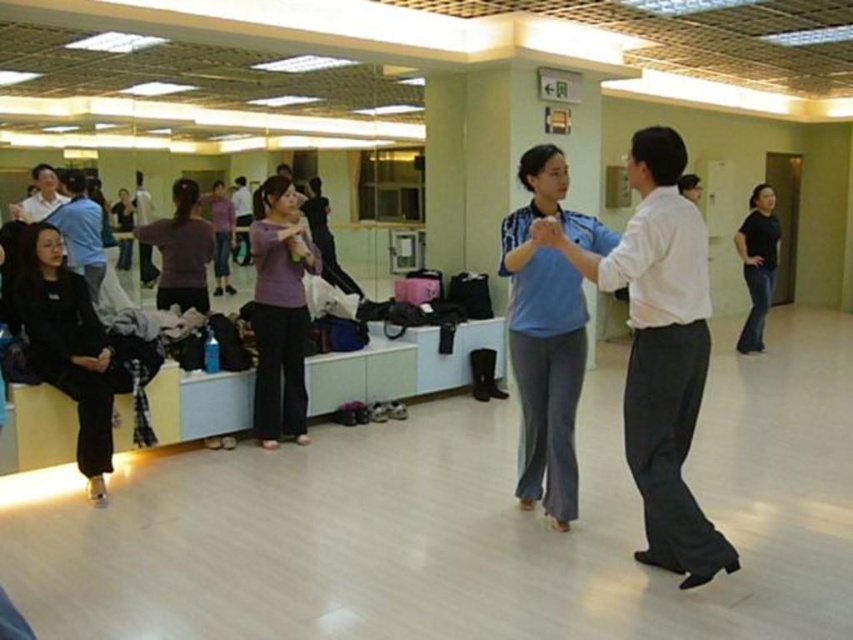
Question: Is blue cotton shirt at center positioned in front of black jeans at right?

Choices:
 (A) yes
 (B) no

Answer: (A)

Question: Considering the relative positions of matte purple sweater at center and black matte jacket at lower left in the image provided, where is matte purple sweater at center located with respect to black matte jacket at lower left?

Choices:
 (A) below
 (B) above

Answer: (A)

Question: Which point is farther to the camera?

Choices:
 (A) (30, 195)
 (B) (622, 248)

Answer: (A)

Question: Estimate the real-world distances between objects in this image. Which object is closer to the matte black shirt at upper left?

Choices:
 (A) black matte pants at lower left
 (B) purple matte sweater at center
 (C) black jeans at right

Answer: (A)

Question: Is white smooth shirt at center to the right of blue cotton shirt at center from the viewer's perspective?

Choices:
 (A) no
 (B) yes

Answer: (B)

Question: Which point is closer to the camera taking this photo?

Choices:
 (A) (183, 224)
 (B) (68, 388)
 (C) (254, 324)

Answer: (B)